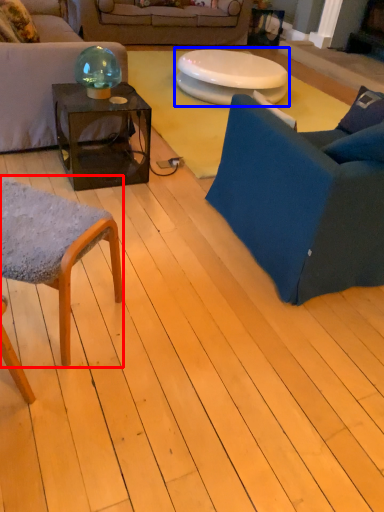
Question: Which object appears farthest to the camera in this image, chair (highlighted by a red box) or table (highlighted by a blue box)?

Choices:
 (A) chair
 (B) table

Answer: (B)